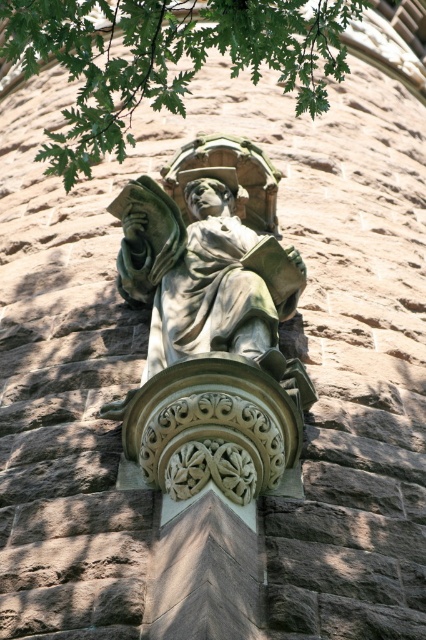
You are standing in front of a building and see the green stone statue at center. If you want to take a photo of the statue, would you need to zoom in or zoom out your camera to focus on the statue?

The green stone statue at center is 47.39 meters from the camera, so you would need to zoom in to focus on the statue from that distance.

Based on the photo, you are a painter standing 5 meters away from the green stone statue at center. You want to paint the green leafy tree at upper center. Can you reach the tree without moving closer than 5 meters from the statue?

The distance between the green stone statue at center and the green leafy tree at upper center is 12.53 meters. Since you are already 5 meters away from the statue, you would need to move an additional 7.53 meters towards the tree to reach it, which would mean moving closer than 5 meters from the statue. Therefore, you cannot reach the tree without moving closer than 5 meters from the statue.